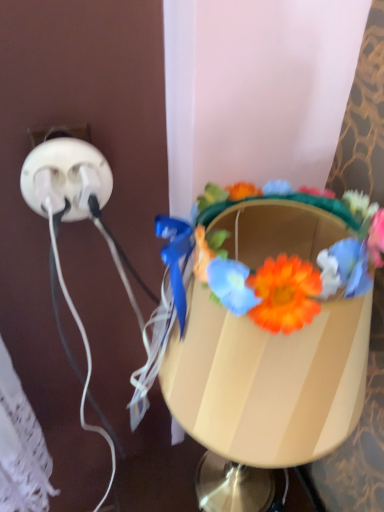
Question: Can you confirm if matte plastic table lamp at center is taller than white plastic power plugs at left?

Choices:
 (A) no
 (B) yes

Answer: (B)

Question: Can you confirm if matte plastic table lamp at center is smaller than white plastic power plugs at left?

Choices:
 (A) yes
 (B) no

Answer: (B)

Question: Is matte plastic table lamp at center outside white plastic power plugs at left?

Choices:
 (A) yes
 (B) no

Answer: (A)

Question: Is matte plastic table lamp at center thinner than white plastic power plugs at left?

Choices:
 (A) yes
 (B) no

Answer: (B)

Question: Considering the relative sizes of matte plastic table lamp at center and white plastic power plugs at left in the image provided, is matte plastic table lamp at center shorter than white plastic power plugs at left?

Choices:
 (A) no
 (B) yes

Answer: (A)

Question: From a real-world perspective, relative to floral crown at center, is white plastic power plugs at left vertically above or below?

Choices:
 (A) below
 (B) above

Answer: (A)

Question: Is point (24, 190) positioned closer to the camera than point (372, 226)?

Choices:
 (A) closer
 (B) farther

Answer: (B)

Question: Considering their positions, is white plastic power plugs at left located in front of or behind floral crown at center?

Choices:
 (A) front
 (B) behind

Answer: (B)

Question: Is white plastic power plugs at left inside the boundaries of floral crown at center, or outside?

Choices:
 (A) inside
 (B) outside

Answer: (B)

Question: Would you say floral crown at center is to the left or to the right of white plastic power plugs at left in the picture?

Choices:
 (A) left
 (B) right

Answer: (B)

Question: Is floral crown at center in front of or behind white plastic power plugs at left in the image?

Choices:
 (A) front
 (B) behind

Answer: (A)

Question: Considering the positions of point (347, 287) and point (99, 201), is point (347, 287) closer or farther from the camera than point (99, 201)?

Choices:
 (A) farther
 (B) closer

Answer: (B)

Question: Is floral crown at center inside the boundaries of white plastic power plugs at left, or outside?

Choices:
 (A) outside
 (B) inside

Answer: (A)

Question: Looking at their shapes, would you say matte plastic table lamp at center is wider or thinner than floral crown at center?

Choices:
 (A) wide
 (B) thin

Answer: (A)

Question: In terms of size, does matte plastic table lamp at center appear bigger or smaller than floral crown at center?

Choices:
 (A) small
 (B) big

Answer: (B)